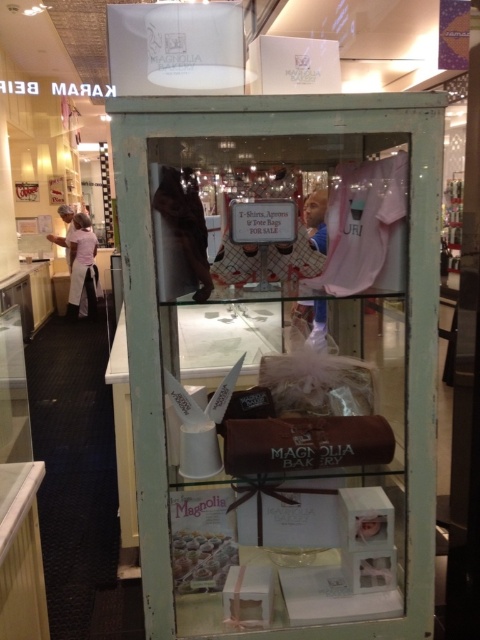
You are a customer at Magnolia Bakery and want to purchase a tote bag. The store has a display cabinet with a top shelf and a middle shelf. The top shelf has two white boxes labeled Magnolia Bakery and a sign stating Tote Bags FOR SALE. The middle shelf has a matte pink fabric at center. Where would you expect to find the tote bags for sale?

The Tote Bags FOR SALE are mentioned on the sign on the top shelf, so you would expect to find the tote bags on the top shelf where the sign is located, not on the middle shelf with the matte pink fabric at center.

You are a customer at Magnolia Bakery and want to buy a gift for your friend. You see the matte pink fabric at center and the white glossy cake at lower center. Which item is located to the right of the other?

The matte pink fabric at center is positioned on the right side of white glossy cake at lower center.

You are a customer in the bakery and want to buy a gift for a friend. The matte pink fabric at center and the white apron at left are both displayed in the cabinet. Which item is shorter in height?

The matte pink fabric at center is not as tall as the white apron at left, so the matte pink fabric at center is shorter in height.